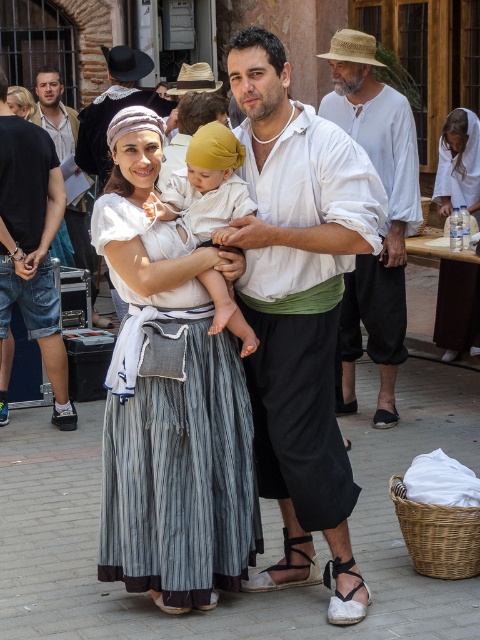
You are a photographer trying to capture the family in the scene. The white cotton shirt at center and the white soft fabric baby at center are both in your viewfinder. Which one is closer to the camera?

The white cotton shirt at center is closer to the camera because it is in front of the white soft fabric baby at center.

You are organizing a costume fitting session for historical reenactors. You have two shirts available for a performer who needs a smaller size. The performer prefers a matte finish. Which shirt should you choose between the white cotton shirt at center and the matte white shirt at center?

The matte white shirt at center is smaller and has the preferred matte finish, so you should choose the matte white shirt at center.